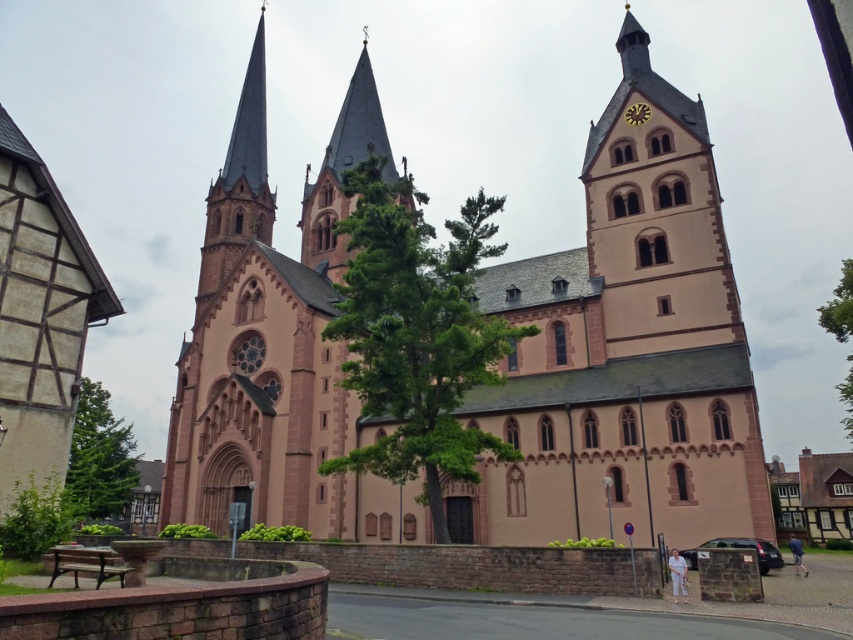
You are a GUI agent. You are given a task and a screenshot of the screen. Output one action in this format:
    pyautogui.click(x=<x>, y=<y>)
    Task: Click on the green leafy tree at right
    The width and height of the screenshot is (853, 640).
    Given the screenshot: What is the action you would take?
    pyautogui.click(x=839, y=307)

Which of these two, green leafy tree at right or yellow plastic clock at upper center, stands shorter?

yellow plastic clock at upper center is shorter.

Does point (844, 280) come in front of point (648, 112)?

No, it is behind (648, 112).

At what (x,y) coordinates should I click in order to perform the action: click on green leafy tree at right. Please return your answer as a coordinate pair (x, y). This screenshot has height=640, width=853. Looking at the image, I should click on (839, 307).

Is green leafy tree at lower left positioned at the back of yellow plastic clock at upper center?

No, it is not.

Who is more distant from viewer, (68, 484) or (633, 108)?

The point (68, 484) is behind.

In order to click on green leafy tree at lower left in this screenshot , I will do `click(99, 458)`.

Does pink stone church at center come behind green leafy tree at right?

No.

Which is more to the right, pink stone church at center or green leafy tree at right?

From the viewer's perspective, green leafy tree at right appears more on the right side.

Does point (737, 424) come closer to viewer compared to point (828, 317)?

Yes, it is in front of point (828, 317).

The image size is (853, 640). In order to click on pink stone church at center in this screenshot , I will do `click(624, 349)`.